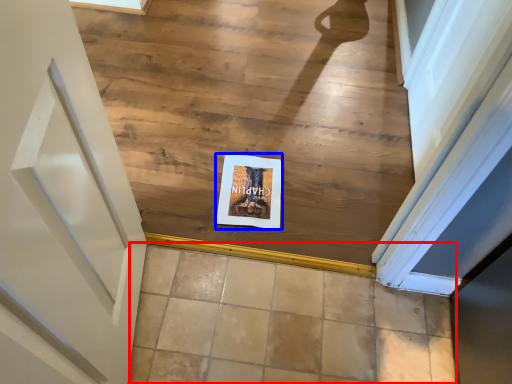
Question: Which object appears closest to the camera in this image, tile (highlighted by a red box) or postcard (highlighted by a blue box)?

Choices:
 (A) tile
 (B) postcard

Answer: (A)